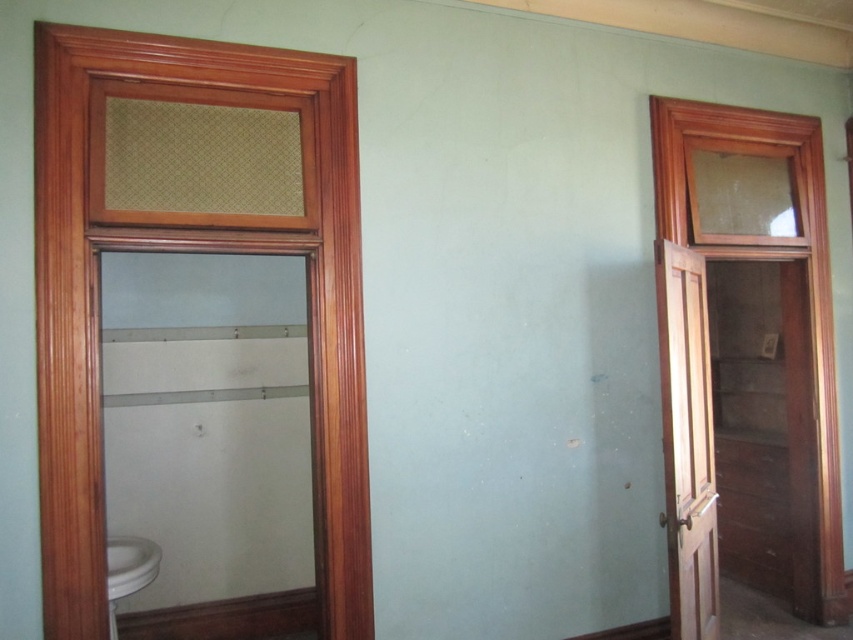
Question: Based on their relative distances, which object is nearer to the light brown wooden screen door at right?

Choices:
 (A) wooden textured window at left
 (B) white glossy sink at lower left

Answer: (A)

Question: From the image, what is the correct spatial relationship of wooden textured window at left in relation to light brown wooden screen door at right?

Choices:
 (A) left
 (B) right

Answer: (A)

Question: From the image, what is the correct spatial relationship of wooden textured window at left in relation to light brown wooden screen door at right?

Choices:
 (A) above
 (B) below

Answer: (A)

Question: Which object appears farthest from the camera in this image?

Choices:
 (A) white glossy sink at lower left
 (B) wooden textured window at left
 (C) light brown wooden screen door at right

Answer: (C)

Question: Among these objects, which one is farthest from the camera?

Choices:
 (A) wooden textured window at left
 (B) white glossy sink at lower left

Answer: (B)

Question: Can you confirm if wooden textured window at left is bigger than white glossy sink at lower left?

Choices:
 (A) no
 (B) yes

Answer: (B)